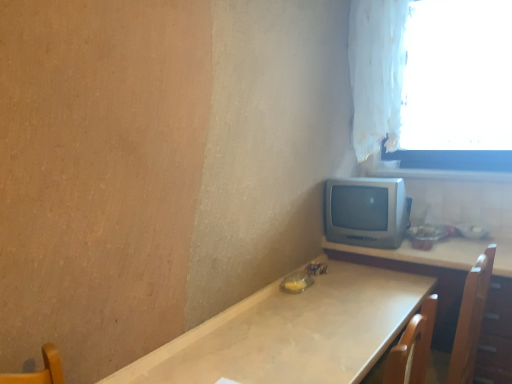
Question: From the image's perspective, does silver metallic tv at center-right appear higher than matte white table at center, which appears as the second table when viewed from the right?

Choices:
 (A) no
 (B) yes

Answer: (B)

Question: Is the position of silver metallic tv at center-right more distant than that of matte white table at center, which ranks as the first table in left-to-right order?

Choices:
 (A) no
 (B) yes

Answer: (B)

Question: Considering the relative sizes of silver metallic tv at center-right and matte white table at center, which appears as the second table when viewed from the right, in the image provided, is silver metallic tv at center-right bigger than matte white table at center, which appears as the second table when viewed from the right,?

Choices:
 (A) no
 (B) yes

Answer: (A)

Question: Is the position of silver metallic tv at center-right less distant than that of matte white table at center, which ranks as the first table in left-to-right order?

Choices:
 (A) yes
 (B) no

Answer: (B)

Question: Considering the relative sizes of silver metallic tv at center-right and matte white table at center, which ranks as the first table in left-to-right order, in the image provided, is silver metallic tv at center-right shorter than matte white table at center, which ranks as the first table in left-to-right order,?

Choices:
 (A) no
 (B) yes

Answer: (B)

Question: Considering the relative positions of silver metallic tv at center-right and matte white table at center, which ranks as the first table in left-to-right order, in the image provided, is silver metallic tv at center-right to the left of matte white table at center, which ranks as the first table in left-to-right order, from the viewer's perspective?

Choices:
 (A) no
 (B) yes

Answer: (A)

Question: Is matte wooden table at right, which is the 2th table from left to right, smaller than white sheer curtain at upper right?

Choices:
 (A) no
 (B) yes

Answer: (A)

Question: Is matte wooden table at right, which is the 2th table from left to right, aimed at white sheer curtain at upper right?

Choices:
 (A) yes
 (B) no

Answer: (B)

Question: Is matte wooden table at right, which is the 2th table from left to right, looking in the opposite direction of white sheer curtain at upper right?

Choices:
 (A) no
 (B) yes

Answer: (A)

Question: From the image's perspective, is matte wooden table at right, which is the 1th table from right to left, located above white sheer curtain at upper right?

Choices:
 (A) yes
 (B) no

Answer: (B)

Question: Does matte wooden table at right, which is the 1th table from right to left, appear on the right side of white sheer curtain at upper right?

Choices:
 (A) yes
 (B) no

Answer: (B)

Question: Considering the relative sizes of matte wooden table at right, which is the 2th table from left to right, and white sheer curtain at upper right in the image provided, is matte wooden table at right, which is the 2th table from left to right, taller than white sheer curtain at upper right?

Choices:
 (A) yes
 (B) no

Answer: (B)

Question: Is white fabric curtain at upper right oriented away from matte wooden table at right, which is the 2th table from left to right?

Choices:
 (A) yes
 (B) no

Answer: (B)